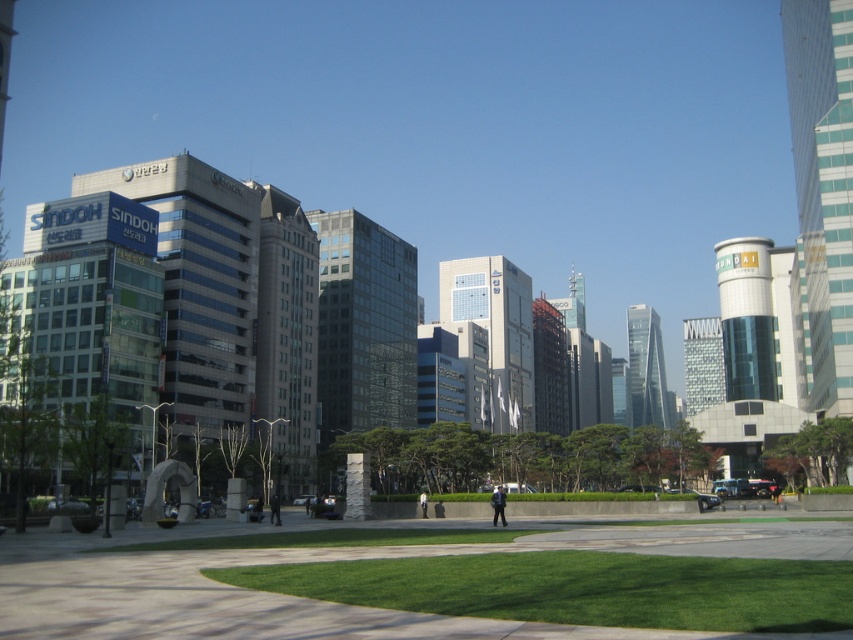
Question: Among these objects, which one is nearest to the camera?

Choices:
 (A) green grass at center
 (B) white fabric person at center
 (C) green lawn at lower center
 (D) dark gray jacket at center

Answer: (C)

Question: Does dark blue uniform at center appear on the left side of dark gray jacket at center?

Choices:
 (A) no
 (B) yes

Answer: (A)

Question: Is dark blue uniform at center above dark gray jacket at center?

Choices:
 (A) no
 (B) yes

Answer: (B)

Question: Which point is closer to the camera taking this photo?

Choices:
 (A) (260, 499)
 (B) (426, 492)
 (C) (221, 545)
 (D) (699, 582)

Answer: (D)

Question: Which object appears closest to the camera in this image?

Choices:
 (A) dark gray jacket at center
 (B) white fabric person at center
 (C) dark blue uniform at center
 (D) dark blue jeans at center

Answer: (C)

Question: Can you confirm if green grass at center is positioned below dark gray jacket at center?

Choices:
 (A) yes
 (B) no

Answer: (B)